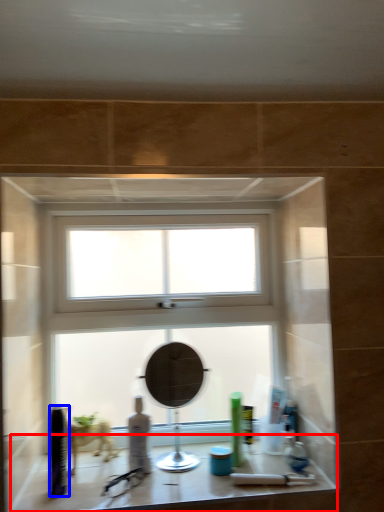
Question: Which object appears farthest to the camera in this image, counter top (highlighted by a red box) or toiletry (highlighted by a blue box)?

Choices:
 (A) counter top
 (B) toiletry

Answer: (B)